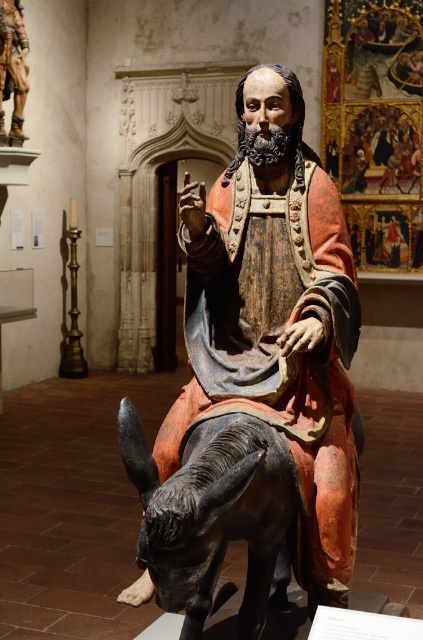
Between point (329, 540) and point (209, 580), which one is positioned in front?

Point (329, 540) is more forward.

Is point (285, 102) farther from camera compared to point (184, 444)?

Yes, it is behind point (184, 444).

Measure the distance between polychrome wood statue at center and camera.

polychrome wood statue at center is 6.50 feet from camera.

The height and width of the screenshot is (640, 423). What are the coordinates of `polychrome wood statue at center` in the screenshot? It's located at (257, 380).

Is shiny black donkey at lower left smaller than wooden figure at upper left?

No.

Does shiny black donkey at lower left have a greater height compared to wooden figure at upper left?

No, shiny black donkey at lower left is not taller than wooden figure at upper left.

Does point (266, 515) come closer to viewer compared to point (19, 54)?

Yes.

The height and width of the screenshot is (640, 423). Identify the location of shiny black donkey at lower left. (211, 513).

Does polychrome wood statue at center appear on the left side of wooden figure at upper left?

In fact, polychrome wood statue at center is to the right of wooden figure at upper left.

Who is positioned more to the right, polychrome wood statue at center or wooden figure at upper left?

Positioned to the right is polychrome wood statue at center.

Is point (192, 307) closer to camera compared to point (14, 13)?

Yes, it is in front of point (14, 13).

Find the location of a particular element. This screenshot has height=640, width=423. polychrome wood statue at center is located at coordinates (257, 380).